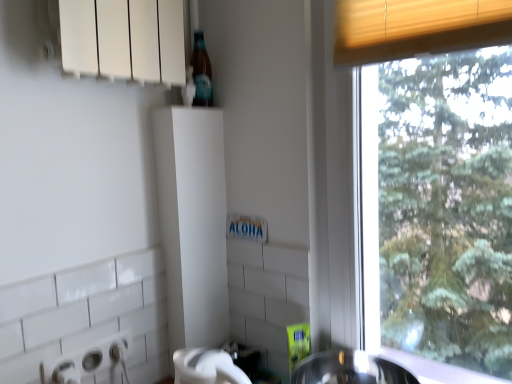
The image size is (512, 384). Describe the element at coordinates (350, 369) in the screenshot. I see `shiny metallic sink at lower center` at that location.

The image size is (512, 384). Identify the location of white plastic bottle at upper center. (122, 38).

The height and width of the screenshot is (384, 512). Find the location of `shiny metallic sink at lower center`. shiny metallic sink at lower center is located at coordinates (350, 369).

Which is in front, white plastic bottle at upper center or shiny metallic sink at lower center?

white plastic bottle at upper center.

Between white plastic bottle at upper center and shiny metallic sink at lower center, which one has larger width?

Wider between the two is shiny metallic sink at lower center.

Is there a large distance between shiny metallic sink at lower center and translucent glass bottle at upper center?

No.

Consider the image. Which is more to the left, shiny metallic sink at lower center or translucent glass bottle at upper center?

Positioned to the left is translucent glass bottle at upper center.

Is shiny metallic sink at lower center facing away from translucent glass bottle at upper center?

No, shiny metallic sink at lower center's orientation is not away from translucent glass bottle at upper center.

From a real-world perspective, is shiny metallic sink at lower center positioned above or below translucent glass bottle at upper center?

shiny metallic sink at lower center is situated lower than translucent glass bottle at upper center in the real world.

How much distance is there between white plastic bottle at upper center and translucent glass bottle at upper center?

They are 9.31 inches apart.

Between point (104, 41) and point (195, 60), which one is positioned in front?

Positioned in front is point (104, 41).

Looking at this image, does white plastic bottle at upper center appear on the left side of translucent glass bottle at upper center?

Yes, white plastic bottle at upper center is to the left of translucent glass bottle at upper center.

Considering the sizes of objects white plastic bottle at upper center and translucent glass bottle at upper center in the image provided, who is wider, white plastic bottle at upper center or translucent glass bottle at upper center?

white plastic bottle at upper center.

Can you confirm if translucent glass bottle at upper center is taller than shiny metallic sink at lower center?

Indeed, translucent glass bottle at upper center has a greater height compared to shiny metallic sink at lower center.

Are translucent glass bottle at upper center and shiny metallic sink at lower center far apart?

No.

Considering the points (192, 58) and (318, 359), which point is in front, point (192, 58) or point (318, 359)?

Positioned in front is point (318, 359).

Is translucent glass bottle at upper center not near white plastic bottle at upper center?

No, there isn't a large distance between translucent glass bottle at upper center and white plastic bottle at upper center.

In the scene shown: Could you measure the distance between translucent glass bottle at upper center and white plastic bottle at upper center?

translucent glass bottle at upper center and white plastic bottle at upper center are 23.65 centimeters apart from each other.

From a real-world perspective, is translucent glass bottle at upper center below white plastic bottle at upper center?

Indeed, from a real-world perspective, translucent glass bottle at upper center is positioned beneath white plastic bottle at upper center.

Which object is further away from the camera, translucent glass bottle at upper center or white plastic bottle at upper center?

Positioned behind is translucent glass bottle at upper center.

From their relative heights in the image, would you say shiny metallic sink at lower center is taller or shorter than white plastic bottle at upper center?

Clearly, shiny metallic sink at lower center is shorter compared to white plastic bottle at upper center.

Is white plastic bottle at upper center inside shiny metallic sink at lower center?

No, white plastic bottle at upper center is located outside of shiny metallic sink at lower center.

Is shiny metallic sink at lower center aimed at white plastic bottle at upper center?

No, shiny metallic sink at lower center is not aimed at white plastic bottle at upper center.

The width and height of the screenshot is (512, 384). Identify the location of window sill on the left of shiny metallic sink at lower center. (122, 38).

In the image, there is a translucent glass bottle at upper center. Where is `sink below it (from a real-world perspective)`? sink below it (from a real-world perspective) is located at coordinates (350, 369).

Which object lies further to the anchor point translucent glass bottle at upper center, shiny metallic sink at lower center or white plastic bottle at upper center?

Based on the image, shiny metallic sink at lower center appears to be further to translucent glass bottle at upper center.

Considering their positions, is white plastic bottle at upper center positioned closer to shiny metallic sink at lower center than translucent glass bottle at upper center?

translucent glass bottle at upper center lies closer to shiny metallic sink at lower center than the other object.

Based on their spatial positions, is white plastic bottle at upper center or shiny metallic sink at lower center closer to translucent glass bottle at upper center?

white plastic bottle at upper center lies closer to translucent glass bottle at upper center than the other object.

Which object lies nearer to the anchor point white plastic bottle at upper center, translucent glass bottle at upper center or shiny metallic sink at lower center?

translucent glass bottle at upper center lies closer to white plastic bottle at upper center than the other object.

Estimate the real-world distances between objects in this image. Which object is closer to shiny metallic sink at lower center, translucent glass bottle at upper center or white plastic bottle at upper center?

translucent glass bottle at upper center.

Estimate the real-world distances between objects in this image. Which object is closer to white plastic bottle at upper center, shiny metallic sink at lower center or translucent glass bottle at upper center?

translucent glass bottle at upper center is positioned closer to the anchor white plastic bottle at upper center.

At what (x,y) coordinates should I click in order to perform the action: click on bottle between white plastic bottle at upper center and shiny metallic sink at lower center in the vertical direction. Please return your answer as a coordinate pair (x, y). The height and width of the screenshot is (384, 512). Looking at the image, I should click on (201, 72).